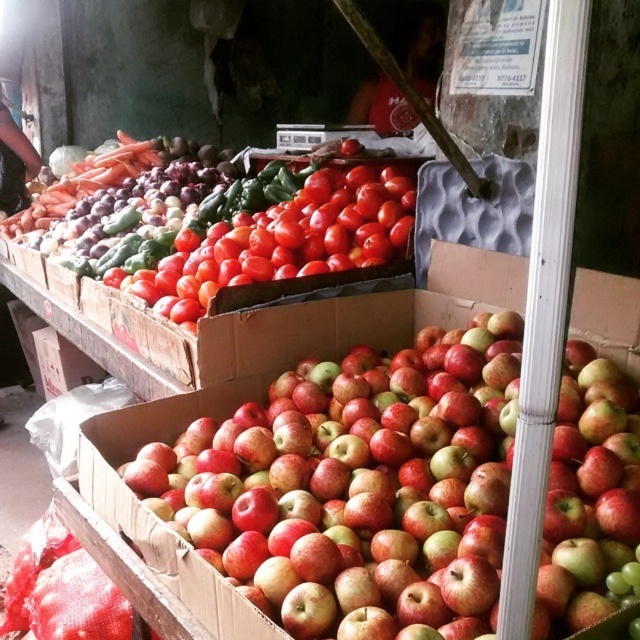
Question: Is red matte apples at center above shiny red tomatoes at center?

Choices:
 (A) yes
 (B) no

Answer: (B)

Question: Considering the relative positions of red matte apples at center and shiny red tomatoes at center in the image provided, where is red matte apples at center located with respect to shiny red tomatoes at center?

Choices:
 (A) left
 (B) right

Answer: (B)

Question: Among these points, which one is farthest from the camera?

Choices:
 (A) (412, 465)
 (B) (228, 243)

Answer: (B)

Question: Which point is farther to the camera?

Choices:
 (A) (394, 548)
 (B) (307, 192)

Answer: (B)

Question: Among these objects, which one is nearest to the camera?

Choices:
 (A) red matte apples at center
 (B) shiny red tomatoes at center

Answer: (A)

Question: From the image, what is the correct spatial relationship of red matte apples at center in relation to shiny red tomatoes at center?

Choices:
 (A) below
 (B) above

Answer: (A)